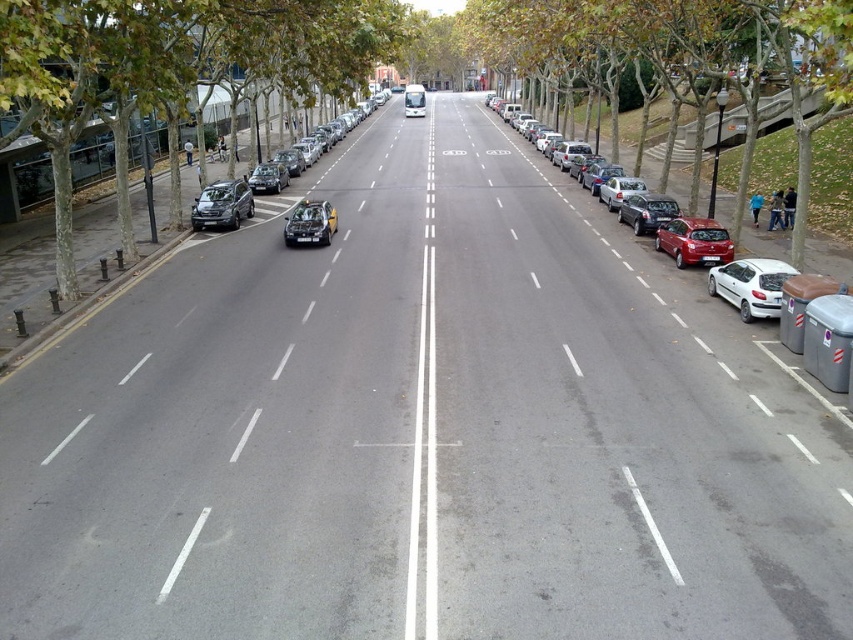
Locate an element on the screen. This screenshot has height=640, width=853. shiny silver car at center is located at coordinates (310, 224).

This screenshot has height=640, width=853. What are the coordinates of `shiny silver car at center` in the screenshot? It's located at (310, 224).

Is shiny black car at center below satin black sedan at right?

No.

Between point (216, 220) and point (664, 195), which one is positioned in front?

Point (216, 220) is more forward.

This screenshot has width=853, height=640. What do you see at coordinates (339, 156) in the screenshot?
I see `shiny black car at center` at bounding box center [339, 156].

Where is `shiny black car at center`? The height and width of the screenshot is (640, 853). shiny black car at center is located at coordinates (339, 156).

Between shiny red sedan at right and shiny red car at right, which one has less height?

shiny red car at right is shorter.

Which is more to the left, shiny red sedan at right or shiny red car at right?

shiny red sedan at right

Who is more distant from viewer, (538, 173) or (656, 241)?

The point (538, 173) is more distant.

Identify the location of shiny red sedan at right. (692, 241).